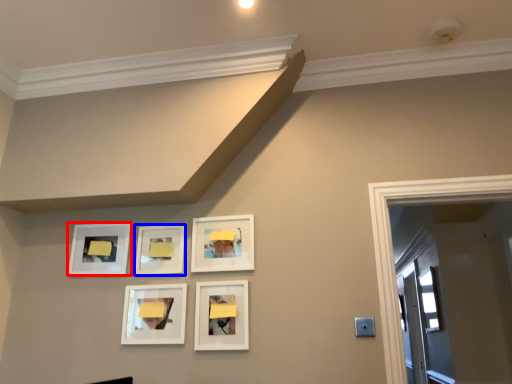
Question: Which point is further to the camera, picture frame (highlighted by a red box) or picture frame (highlighted by a blue box)?

Choices:
 (A) picture frame
 (B) picture frame

Answer: (A)